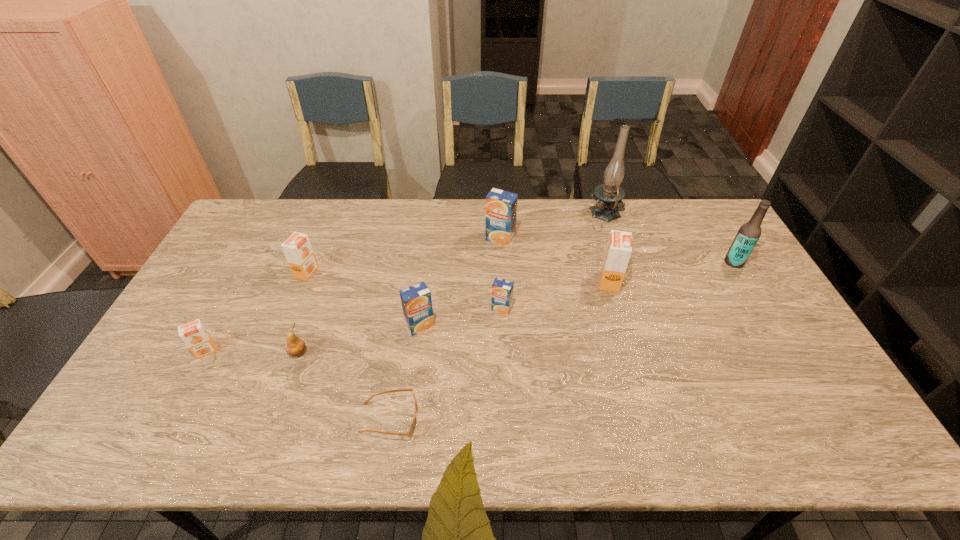
Locate an element on the screen. Image resolution: width=960 pixels, height=540 pixels. vacant region located on the label of the beer bottle is located at coordinates (648, 262).

Where is `vacant area located 0.390m on the label of the beer bottle`? vacant area located 0.390m on the label of the beer bottle is located at coordinates (606, 262).

Where is `blank space located on the label of the beer bottle`? blank space located on the label of the beer bottle is located at coordinates (630, 262).

I want to click on free location located on the front of the farthest orange juice, so (505, 334).

Identify the location of free region located on the right of the rightmost orange orange juice. The width and height of the screenshot is (960, 540). (731, 282).

Find the location of a particular element. Image resolution: width=960 pixels, height=540 pixels. vacant space situated 0.110m on the left of the seventh farthest object is located at coordinates (367, 326).

Find the location of a particular element. free region located 0.240m on the front of the second orange orange juice from right to left is located at coordinates (278, 343).

The height and width of the screenshot is (540, 960). I want to click on free region located 0.380m on the back of the third nearest orange juice, so click(x=498, y=224).

What are the coordinates of `vacant space located on the back of the leftmost object` in the screenshot? It's located at (223, 320).

Where is `vacant space located 0.120m on the front of the pear`? The image size is (960, 540). vacant space located 0.120m on the front of the pear is located at coordinates (281, 401).